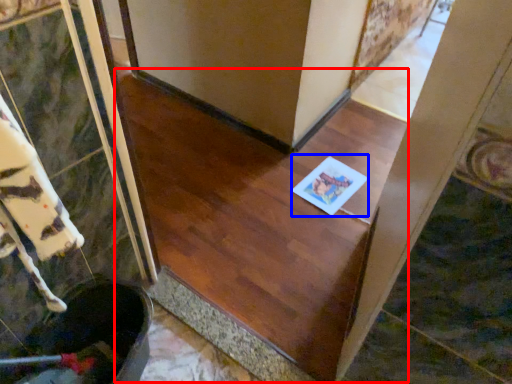
Question: Which point is closer to the camera, stairwell (highlighted by a red box) or copy (highlighted by a blue box)?

Choices:
 (A) stairwell
 (B) copy

Answer: (A)